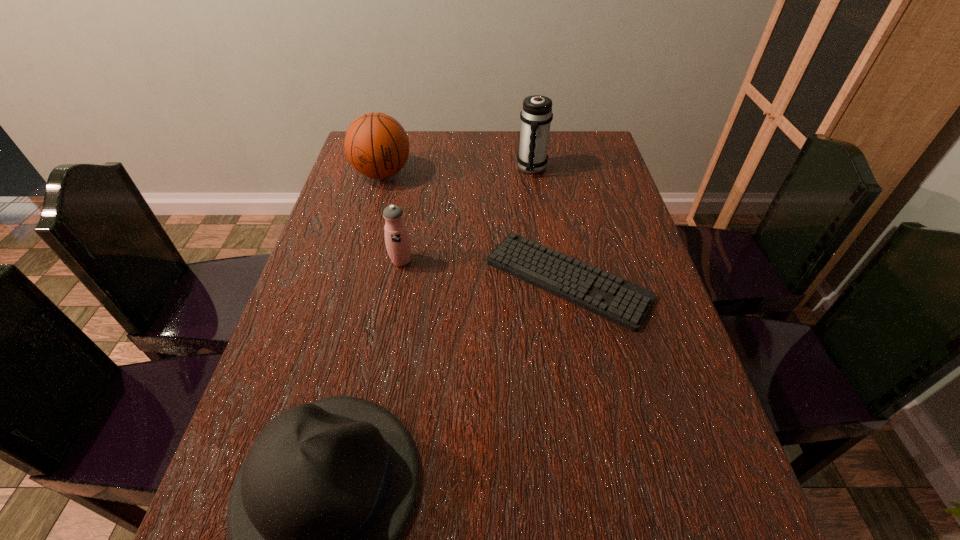
The height and width of the screenshot is (540, 960). I want to click on thermos bottle that is positioned at the far edge, so click(536, 115).

You are a GUI agent. You are given a task and a screenshot of the screen. Output one action in this format:
    pyautogui.click(x=<x>, y=<y>)
    Task: Click on the basketball that is at the far edge
    
    Given the screenshot: What is the action you would take?
    pyautogui.click(x=377, y=146)

You are a GUI agent. You are given a task and a screenshot of the screen. Output one action in this format:
    pyautogui.click(x=<x>, y=<y>)
    Task: Click on the object that is at the left edge
    
    Given the screenshot: What is the action you would take?
    (x=377, y=146)

The height and width of the screenshot is (540, 960). Find the location of `object located in the right edge section of the desktop`. object located in the right edge section of the desktop is located at coordinates (622, 302).

Identify the location of object that is at the far left corner. This screenshot has width=960, height=540. 377,146.

Identify the location of free region at the far edge of the desktop. The width and height of the screenshot is (960, 540). (451, 164).

Identify the location of vacant region at the left edge. (326, 226).

The width and height of the screenshot is (960, 540). In the image, there is a desktop. In order to click on vacant region at the right edge in this screenshot , I will do (580, 213).

Where is `free space at the far right corner of the desktop`? Image resolution: width=960 pixels, height=540 pixels. free space at the far right corner of the desktop is located at coordinates (596, 145).

Locate an element on the screen. free space between the shortest object and the basketball is located at coordinates (475, 227).